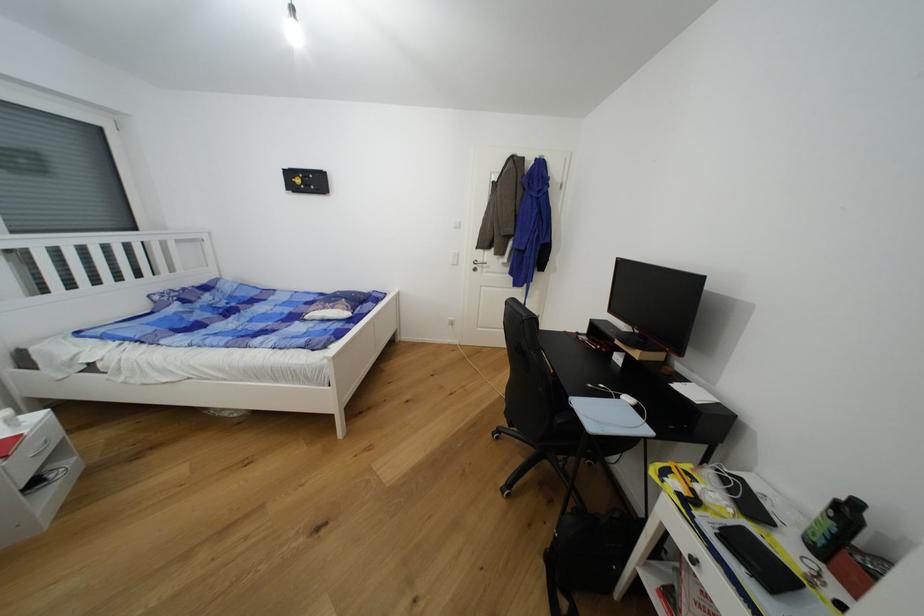
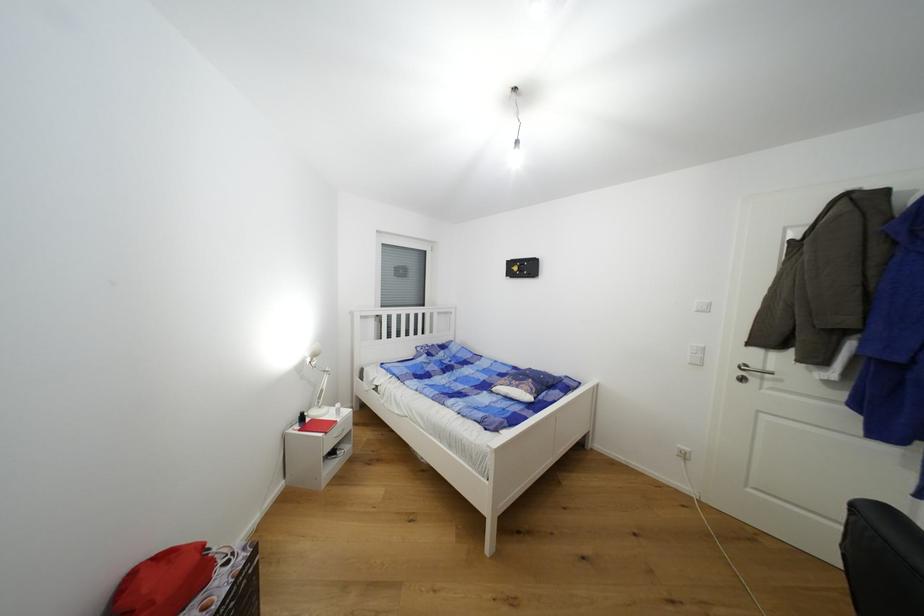
Question: The images are taken continuously from a first-person perspective. In which direction is your viewpoint rotating?

Choices:
 (A) Left
 (B) Right
 (C) Up
 (D) Down

Answer: (A)